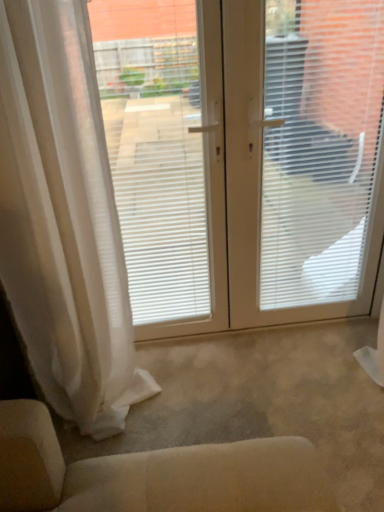
Locate an element on the screen. The height and width of the screenshot is (512, 384). white matte window blind at center is located at coordinates (320, 149).

What is the approximate width of white sheer curtain at left?

The width of white sheer curtain at left is 12.94 inches.

Describe the element at coordinates (63, 219) in the screenshot. The width and height of the screenshot is (384, 512). I see `white sheer curtain at left` at that location.

Find the location of a particular element. This screenshot has width=384, height=512. white matte window screen at left, which is the first window screen in left-to-right order is located at coordinates (155, 151).

Find the location of a particular element. This screenshot has height=512, width=384. white plastic window screen at center, which is the 2th window screen in left-to-right order is located at coordinates (244, 157).

Measure the distance between white plastic window screen at center, which is the 2th window screen in left-to-right order, and white matte window screen at left, marked as the 2th window screen in a right-to-left arrangement.

white plastic window screen at center, which is the 2th window screen in left-to-right order, and white matte window screen at left, marked as the 2th window screen in a right-to-left arrangement, are 6.83 inches apart from each other.

Is point (306, 198) positioned after point (155, 114)?

Yes.

Is white plastic window screen at center, which is counted as the first window screen, starting from the right, wider or thinner than white matte window screen at left, marked as the 2th window screen in a right-to-left arrangement?

white plastic window screen at center, which is counted as the first window screen, starting from the right, is thinner than white matte window screen at left, marked as the 2th window screen in a right-to-left arrangement.

From the picture: Is white plastic window screen at center, which is counted as the first window screen, starting from the right, directly adjacent to white matte window screen at left, marked as the 2th window screen in a right-to-left arrangement?

No, white plastic window screen at center, which is counted as the first window screen, starting from the right, is not making contact with white matte window screen at left, marked as the 2th window screen in a right-to-left arrangement.

Is white matte window screen at left, which is the first window screen in left-to-right order, wider than white sheer curtain at left?

In fact, white matte window screen at left, which is the first window screen in left-to-right order, might be narrower than white sheer curtain at left.

Does white matte window screen at left, which is the first window screen in left-to-right order, come in front of white sheer curtain at left?

No, it is not.

Is white matte window screen at left, which is the first window screen in left-to-right order, positioned with its back to white sheer curtain at left?

No, white matte window screen at left, which is the first window screen in left-to-right order, is not facing the opposite direction of white sheer curtain at left.

Starting from the white sheer curtain at left, which window screen is the 1st one to the right? Please provide its 2D coordinates.

[(155, 151)]

Considering the points (167, 191) and (310, 27), which point is in front, point (167, 191) or point (310, 27)?

The point (310, 27) is in front.

From the image's perspective, which is above, white matte window screen at left, marked as the 2th window screen in a right-to-left arrangement, or white plastic window screen at center, which is counted as the first window screen, starting from the right?

white plastic window screen at center, which is counted as the first window screen, starting from the right, from the image's perspective.

Based on their positions, is white matte window screen at left, which is the first window screen in left-to-right order, located to the left or right of white plastic window screen at center, which is counted as the first window screen, starting from the right?

white matte window screen at left, which is the first window screen in left-to-right order, is positioned on white plastic window screen at center, which is counted as the first window screen, starting from the right,'s left side.

From the image's perspective, does white matte window blind at center appear lower than white sheer curtain at left?

No, from the image's perspective, white matte window blind at center is not beneath white sheer curtain at left.

From a real-world perspective, which is physically below, white matte window blind at center or white sheer curtain at left?

In real-world perspective, white sheer curtain at left is lower.

Is white matte window blind at center wider or thinner than white sheer curtain at left?

Clearly, white matte window blind at center has less width compared to white sheer curtain at left.

Is white sheer curtain at left taller or shorter than white matte window blind at center?

white sheer curtain at left is taller than white matte window blind at center.

How different are the orientations of white sheer curtain at left and white matte window blind at center in degrees?

The angular difference between white sheer curtain at left and white matte window blind at center is 0.455 degrees.

Based on the photo, are white sheer curtain at left and white matte window blind at center far apart?

Actually, white sheer curtain at left and white matte window blind at center are a little close together.

Which is farther, (2,153) or (270,198)?

The point (270,198) is farther.

Can you confirm if white plastic window screen at center, which is counted as the first window screen, starting from the right, is positioned to the right of white matte window blind at center?

No, white plastic window screen at center, which is counted as the first window screen, starting from the right, is not to the right of white matte window blind at center.

Can white matte window blind at center be found inside white plastic window screen at center, which is the 2th window screen in left-to-right order?

Yes, white matte window blind at center is a part of white plastic window screen at center, which is the 2th window screen in left-to-right order.

Can you confirm if white plastic window screen at center, which is the 2th window screen in left-to-right order, is smaller than white matte window blind at center?

Indeed, white plastic window screen at center, which is the 2th window screen in left-to-right order, has a smaller size compared to white matte window blind at center.

Is white matte window screen at left, marked as the 2th window screen in a right-to-left arrangement, aimed at white matte window blind at center?

No, white matte window screen at left, marked as the 2th window screen in a right-to-left arrangement, is not turned towards white matte window blind at center.

Is white matte window screen at left, marked as the 2th window screen in a right-to-left arrangement, far away from white matte window blind at center?

Actually, white matte window screen at left, marked as the 2th window screen in a right-to-left arrangement, and white matte window blind at center are a little close together.

Can you confirm if white matte window screen at left, which is the first window screen in left-to-right order, is shorter than white matte window blind at center?

No, white matte window screen at left, which is the first window screen in left-to-right order, is not shorter than white matte window blind at center.

From the image's perspective, would you say white matte window screen at left, which is the first window screen in left-to-right order, is shown under white matte window blind at center?

Yes, from the image's perspective, white matte window screen at left, which is the first window screen in left-to-right order, is beneath white matte window blind at center.

Identify the location of window screen on the left side of white plastic window screen at center, which is counted as the first window screen, starting from the right. (155, 151).

Find the location of a particular element. The image size is (384, 512). the 1st window screen to the right of the white sheer curtain at left, counting from the anchor's position is located at coordinates (155, 151).

Which object lies nearer to the anchor point white sheer curtain at left, white plastic window screen at center, which is counted as the first window screen, starting from the right, or white matte window screen at left, which is the first window screen in left-to-right order?

The object closer to white sheer curtain at left is white matte window screen at left, which is the first window screen in left-to-right order.

Based on their spatial positions, is white sheer curtain at left or white plastic window screen at center, which is counted as the first window screen, starting from the right, closer to white matte window screen at left, which is the first window screen in left-to-right order?

Among the two, white plastic window screen at center, which is counted as the first window screen, starting from the right, is located nearer to white matte window screen at left, which is the first window screen in left-to-right order.

From the picture: When comparing their distances from white sheer curtain at left, does white matte window screen at left, which is the first window screen in left-to-right order, or white plastic window screen at center, which is counted as the first window screen, starting from the right, seem closer?

white matte window screen at left, which is the first window screen in left-to-right order, is positioned closer to the anchor white sheer curtain at left.

Based on their spatial positions, is white plastic window screen at center, which is the 2th window screen in left-to-right order, or white matte window screen at left, marked as the 2th window screen in a right-to-left arrangement, further from white matte window blind at center?

Based on the image, white matte window screen at left, marked as the 2th window screen in a right-to-left arrangement, appears to be further to white matte window blind at center.

Estimate the real-world distances between objects in this image. Which object is further from white matte window blind at center, white matte window screen at left, marked as the 2th window screen in a right-to-left arrangement, or white sheer curtain at left?

white sheer curtain at left lies further to white matte window blind at center than the other object.

Which object lies nearer to the anchor point white matte window screen at left, which is the first window screen in left-to-right order, white plastic window screen at center, which is the 2th window screen in left-to-right order, or white matte window blind at center?

white plastic window screen at center, which is the 2th window screen in left-to-right order, lies closer to white matte window screen at left, which is the first window screen in left-to-right order, than the other object.

Estimate the real-world distances between objects in this image. Which object is closer to white matte window blind at center, white sheer curtain at left or white matte window screen at left, marked as the 2th window screen in a right-to-left arrangement?

Based on the image, white matte window screen at left, marked as the 2th window screen in a right-to-left arrangement, appears to be nearer to white matte window blind at center.

From the image, which object appears to be nearer to white matte window blind at center, white sheer curtain at left or white plastic window screen at center, which is the 2th window screen in left-to-right order?

Among the two, white plastic window screen at center, which is the 2th window screen in left-to-right order, is located nearer to white matte window blind at center.

At what (x,y) coordinates should I click in order to perform the action: click on window screen between white sheer curtain at left and white plastic window screen at center, which is the 2th window screen in left-to-right order, from left to right. Please return your answer as a coordinate pair (x, y). The width and height of the screenshot is (384, 512). Looking at the image, I should click on (155, 151).

This screenshot has width=384, height=512. I want to click on window screen between white matte window screen at left, which is the first window screen in left-to-right order, and white matte window blind at center, in the horizontal direction, so [244, 157].